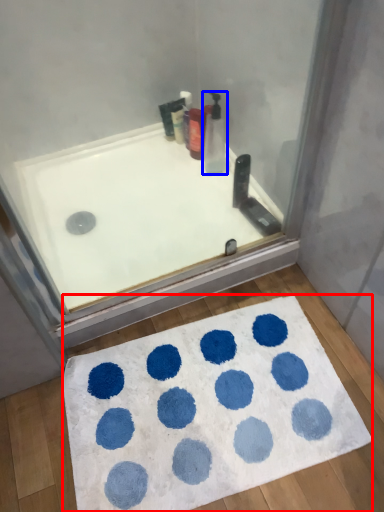
Question: Which object is closer to the camera taking this photo, bath mat (highlighted by a red box) or cleaning product (highlighted by a blue box)?

Choices:
 (A) bath mat
 (B) cleaning product

Answer: (A)